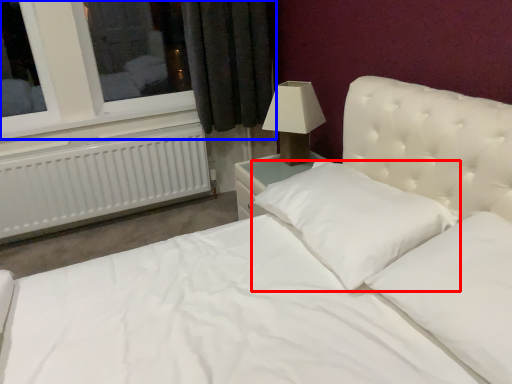
Question: Among these objects, which one is nearest to the camera, pillow (highlighted by a red box) or window (highlighted by a blue box)?

Choices:
 (A) pillow
 (B) window

Answer: (A)